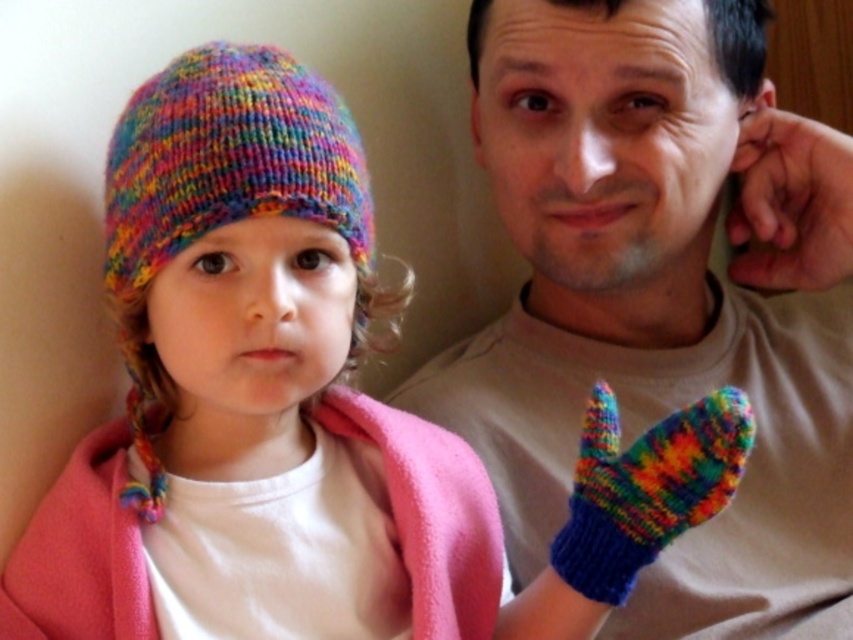
Question: Which object appears farthest from the camera in this image?

Choices:
 (A) knitted beige shirt at center
 (B) smooth skin hand at upper right
 (C) multicolored knitted hat at left
 (D) multicolored knitted mitten at right

Answer: (B)

Question: Observing the image, what is the correct spatial positioning of knitted beige shirt at center in reference to multicolored knitted hat at left?

Choices:
 (A) right
 (B) left

Answer: (A)

Question: Does multicolored knitted mitten at right have a lesser width compared to smooth skin hand at upper right?

Choices:
 (A) yes
 (B) no

Answer: (A)

Question: Which of the following is the farthest from the observer?

Choices:
 (A) (688, 497)
 (B) (804, 237)
 (C) (665, 220)
 (D) (318, 170)

Answer: (B)

Question: Which of the following is the closest to the observer?

Choices:
 (A) (740, 396)
 (B) (335, 141)

Answer: (A)

Question: Considering the relative positions of knitted beige shirt at center and multicolored knitted hat at left in the image provided, where is knitted beige shirt at center located with respect to multicolored knitted hat at left?

Choices:
 (A) below
 (B) above

Answer: (A)